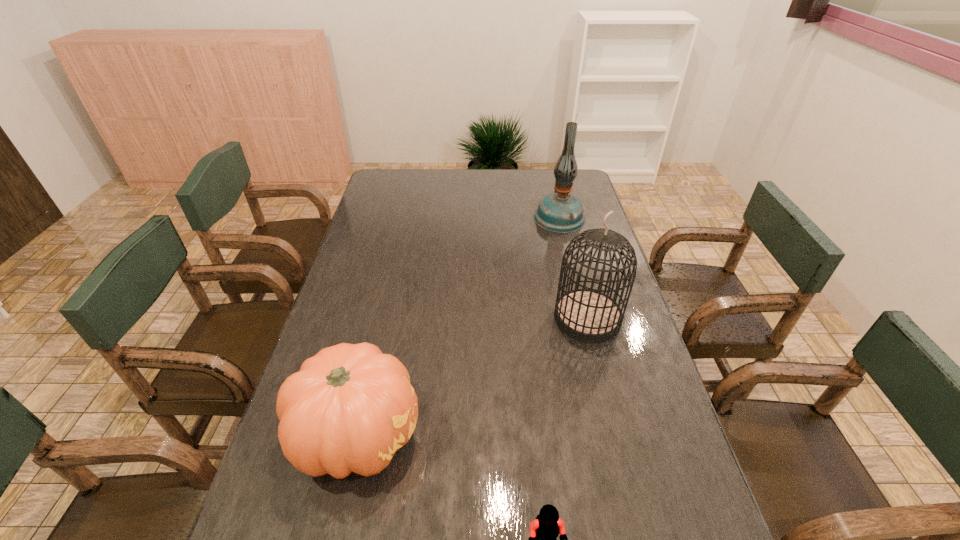
At what (x,y) coordinates should I click in order to perform the action: click on oil lamp. Please return your answer as a coordinate pair (x, y). The image size is (960, 540). Looking at the image, I should click on (560, 212).

At what (x,y) coordinates should I click in order to perform the action: click on birdcage. Please return your answer as a coordinate pair (x, y). Image resolution: width=960 pixels, height=540 pixels. Looking at the image, I should click on (588, 315).

Find the location of `the third tallest object`. the third tallest object is located at coordinates (350, 407).

The height and width of the screenshot is (540, 960). Find the location of `pumpkin`. pumpkin is located at coordinates (350, 407).

Where is `vacant space situated on the front of the farthest object`? The height and width of the screenshot is (540, 960). vacant space situated on the front of the farthest object is located at coordinates (568, 257).

Locate an element on the screen. Image resolution: width=960 pixels, height=540 pixels. free space located 0.170m on the left of the second farthest object is located at coordinates (496, 318).

The height and width of the screenshot is (540, 960). What are the coordinates of `vacant space located 0.320m on the carved face of the third farthest object` in the screenshot? It's located at (563, 434).

Where is `object that is at the left edge`? This screenshot has height=540, width=960. object that is at the left edge is located at coordinates (350, 407).

Where is `oil lamp at the right edge`? oil lamp at the right edge is located at coordinates point(560,212).

This screenshot has height=540, width=960. What are the coordinates of `birdcage located in the right edge section of the desktop` in the screenshot? It's located at (588, 315).